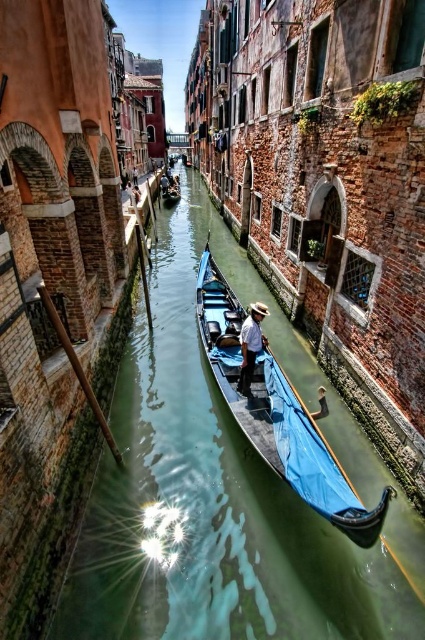
Which is behind, point (351, 595) or point (246, 337)?

The point (246, 337) is behind.

Can you confirm if green smooth water at center is wider than light brown straw hat at center?

Correct, the width of green smooth water at center exceeds that of light brown straw hat at center.

This screenshot has height=640, width=425. What are the coordinates of `green smooth water at center` in the screenshot? It's located at (212, 490).

Which of these two, blue fabric boat at center or light brown straw hat at center, stands taller?

blue fabric boat at center is taller.

At what (x,y) coordinates should I click in order to perform the action: click on blue fabric boat at center. Please return your answer as a coordinate pair (x, y). Looking at the image, I should click on (277, 413).

Does green smooth water at center have a larger size compared to blue fabric boat at center?

Correct, green smooth water at center is larger in size than blue fabric boat at center.

Is green smooth water at center to the right of blue fabric boat at center from the viewer's perspective?

No, green smooth water at center is not to the right of blue fabric boat at center.

Identify the location of green smooth water at center. This screenshot has width=425, height=640. (212, 490).